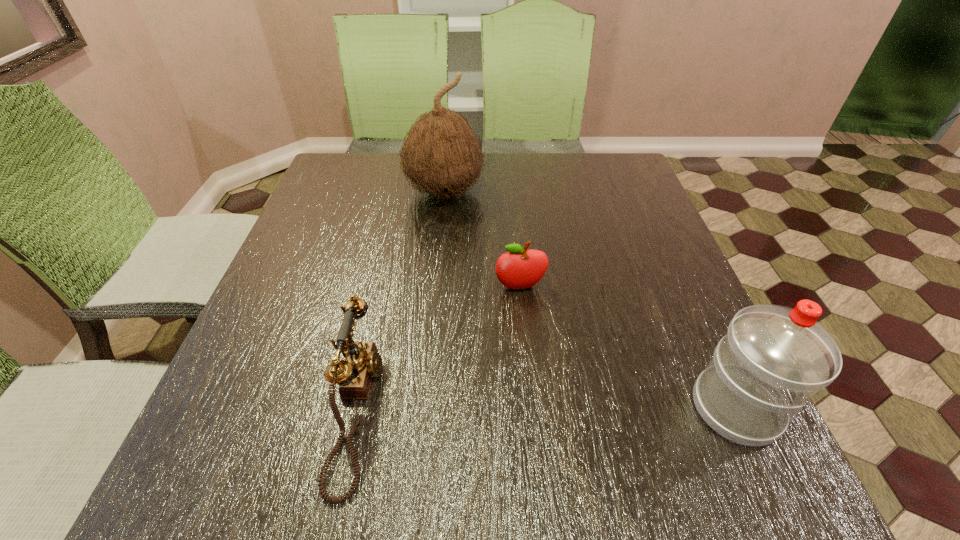
Where is `free space located on the front-facing side of the third object from left to right`? This screenshot has height=540, width=960. free space located on the front-facing side of the third object from left to right is located at coordinates (545, 411).

You are a GUI agent. You are given a task and a screenshot of the screen. Output one action in this format:
    pyautogui.click(x=<x>, y=<y>)
    Task: Click on the vacant space located on the surface of the farthest object
    The width and height of the screenshot is (960, 540).
    Given the screenshot: What is the action you would take?
    pyautogui.click(x=487, y=319)

Locate an element on the screen. The width and height of the screenshot is (960, 540). free space located on the surface of the farthest object is located at coordinates (476, 288).

The width and height of the screenshot is (960, 540). I want to click on vacant space positioned on the surface of the farthest object, so click(x=481, y=301).

Locate an element on the screen. object present at the far edge is located at coordinates (441, 155).

Image resolution: width=960 pixels, height=540 pixels. Find the location of `telephone present at the near edge`. telephone present at the near edge is located at coordinates (362, 362).

Where is `water bottle located at the near edge`? This screenshot has height=540, width=960. water bottle located at the near edge is located at coordinates (773, 358).

This screenshot has width=960, height=540. In order to click on object at the right edge in this screenshot , I will do `click(773, 358)`.

Locate an element on the screen. The height and width of the screenshot is (540, 960). object that is at the near right corner is located at coordinates (773, 358).

In the image, there is a desktop. At what (x,y) coordinates should I click in order to perform the action: click on free space at the far edge. Please return your answer as a coordinate pair (x, y). The height and width of the screenshot is (540, 960). Looking at the image, I should click on (542, 178).